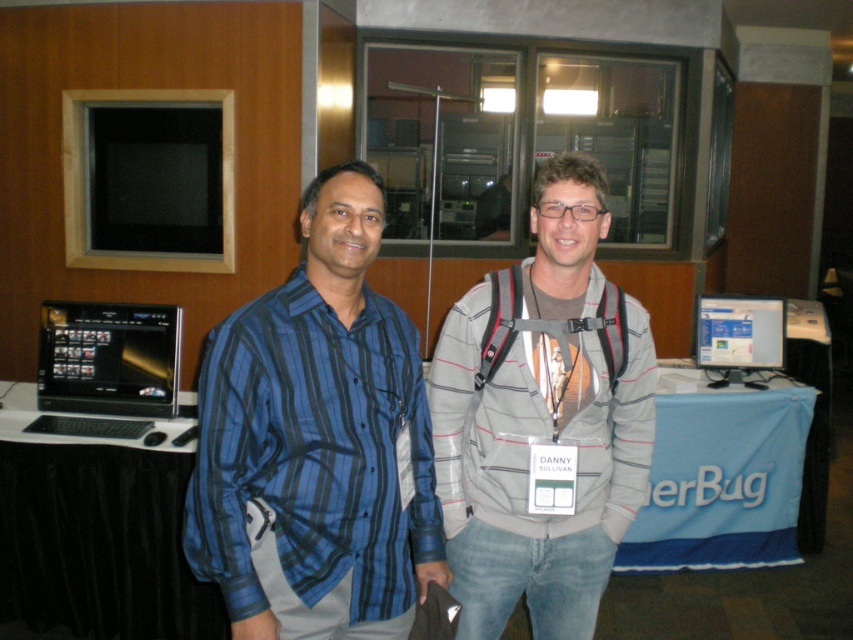
You are a photographer at the event and need to capture a clear photo of the matte black monitor at center without any obstructions. Is the gray striped hoodie at center blocking the monitor?

The gray striped hoodie at center is in front of the matte black monitor at center, so it is blocking the monitor. Move the hoodie or adjust the camera angle to capture an unobstructed view of the matte black monitor at center.

You are standing in the conference room and need to locate the gray striped hoodie at center and the matte black monitor at center. According to their positions, which object is closer to the left side of the room?

The gray striped hoodie at center is closer to the left side of the room because it is positioned to the left of the matte black monitor at center.